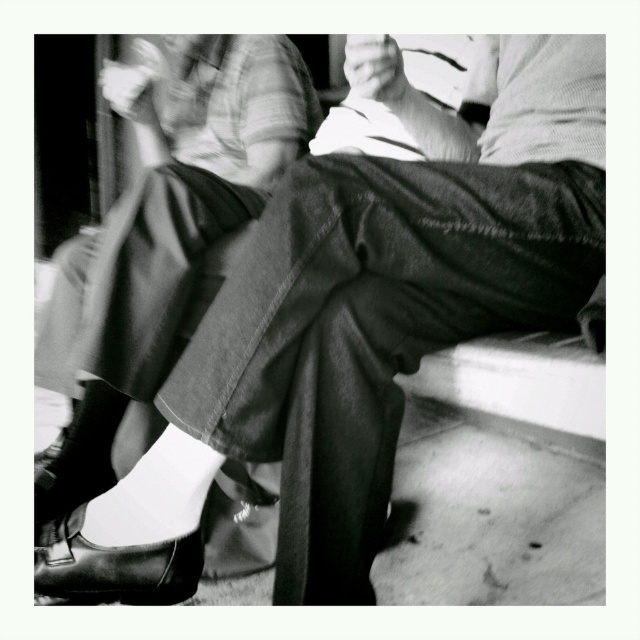
Which is in front, point (106, 426) or point (147, 566)?

Point (147, 566)

The image size is (640, 640). What do you see at coordinates (172, 224) in the screenshot?
I see `denim pants at center` at bounding box center [172, 224].

In order to click on denim pants at center in this screenshot , I will do `click(172, 224)`.

Does denim pants at center have a lesser width compared to leather shoe at lower left?

Incorrect, denim pants at center's width is not less than leather shoe at lower left's.

Where is `denim pants at center`? This screenshot has width=640, height=640. denim pants at center is located at coordinates (172, 224).

Can you confirm if shiny leather shoe at lower left is bigger than leather shoe at lower left?

Actually, shiny leather shoe at lower left might be smaller than leather shoe at lower left.

Between shiny leather shoe at lower left and leather shoe at lower left, which one is positioned lower?

shiny leather shoe at lower left is lower down.

Is point (54, 536) positioned in front of point (61, 492)?

Yes, point (54, 536) is closer to viewer.

At what (x,y) coordinates should I click in order to perform the action: click on shiny leather shoe at lower left. Please return your answer as a coordinate pair (x, y). The width and height of the screenshot is (640, 640). Looking at the image, I should click on (113, 564).